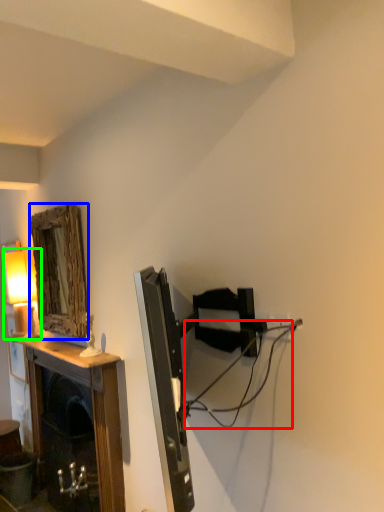
Question: Which object is the closest to the cable (highlighted by a red box)? Choose among these: mirror (highlighted by a blue box) or table lamp (highlighted by a green box).

Choices:
 (A) mirror
 (B) table lamp

Answer: (A)